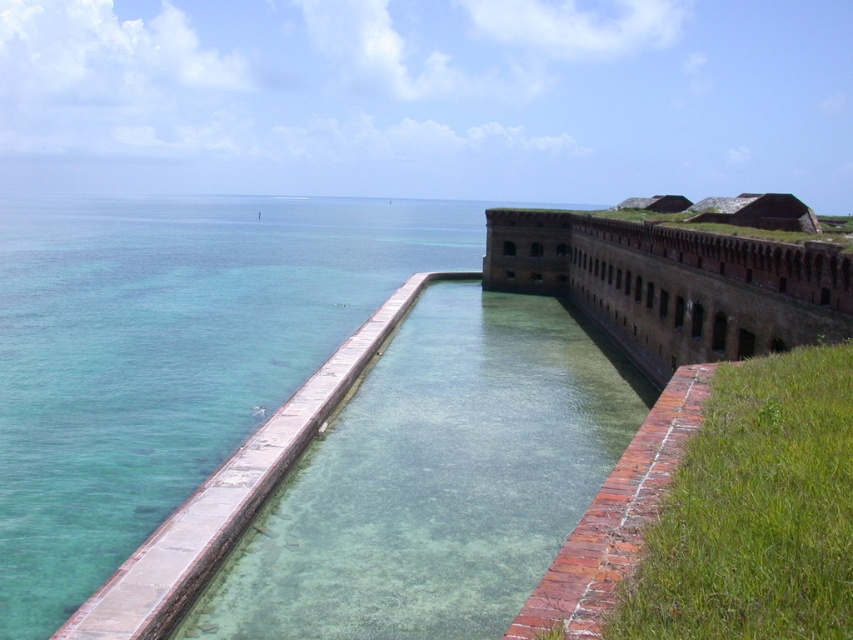
Consider the image. Is clear concrete pool at center thinner than brown brick wall at center?

Incorrect, clear concrete pool at center's width is not less than brown brick wall at center's.

Between clear concrete pool at center and brown brick wall at center, which one is positioned higher?

brown brick wall at center

Describe the element at coordinates (434, 480) in the screenshot. I see `clear concrete pool at center` at that location.

Locate an element on the screen. The height and width of the screenshot is (640, 853). clear concrete pool at center is located at coordinates (434, 480).